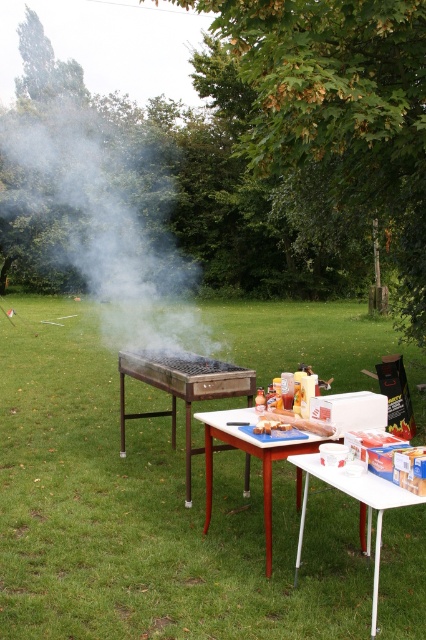
Is white smoke at left shorter than white plastic table at lower right?

No.

Does white smoke at left have a greater height compared to white plastic table at lower right?

Correct, white smoke at left is much taller as white plastic table at lower right.

You are a GUI agent. You are given a task and a screenshot of the screen. Output one action in this format:
    pyautogui.click(x=<x>, y=<y>)
    Task: Click on the white smoke at left
    This screenshot has height=640, width=426.
    Given the screenshot: What is the action you would take?
    coord(91,200)

Locate an element on the screen. The image size is (426, 640). white smoke at left is located at coordinates (91, 200).

Which is above, green grass at center or white plastic table at lower right?

Positioned higher is green grass at center.

Between point (321, 547) and point (333, 483), which one is positioned in front?

Point (333, 483) is in front.

The width and height of the screenshot is (426, 640). I want to click on green grass at center, so tap(147, 512).

Locate an element on the screen. This screenshot has height=640, width=426. green grass at center is located at coordinates (147, 512).

Can you confirm if white smoke at left is positioned above wooden grill at center?

Correct, white smoke at left is located above wooden grill at center.

Between white smoke at left and wooden grill at center, which one has more height?

Standing taller between the two is white smoke at left.

Who is more distant from viewer, (144, 154) or (138, 352)?

The point (144, 154) is more distant.

This screenshot has width=426, height=640. In order to click on white smoke at left in this screenshot , I will do [x=91, y=200].